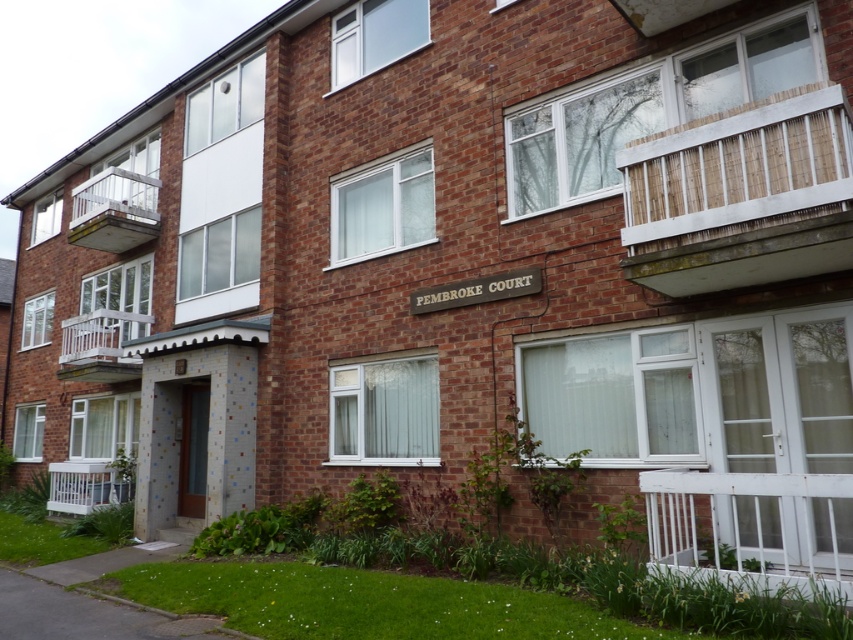
You are standing in front of Pembroke Court, and you want to know if you can comfortably walk under the white wooden balcony at lower right. The average height of a person is 1.7 meters. Can you walk under it without bending?

The distance between the viewer and the white wooden balcony at lower right is 4.84 meters. Since this distance is much greater than the average person height of 1.7 meters, you can comfortably walk under the white wooden balcony at lower right without bending.

You are a delivery person approaching Pembroke Court and need to park your van near the entrance. You notice two white wooden balconies, the wooden white balcony at left and the white wooden balcony at lower left. Which balcony has a wider structure?

The white wooden balcony at lower left has a greater width compared to the wooden white balcony at left, so the white wooden balcony at lower left is wider.

You are planning to place a small garden bench on one of the balconies. The bench requires a minimum of 2 meters of space. Given the white wooden balcony at lower right and the wooden white balcony at left, which balcony would be suitable for placing the bench?

The wooden white balcony at left has a greater width than the white wooden balcony at lower right, so it would be suitable for placing the bench as it likely meets the 2 meters space requirement.